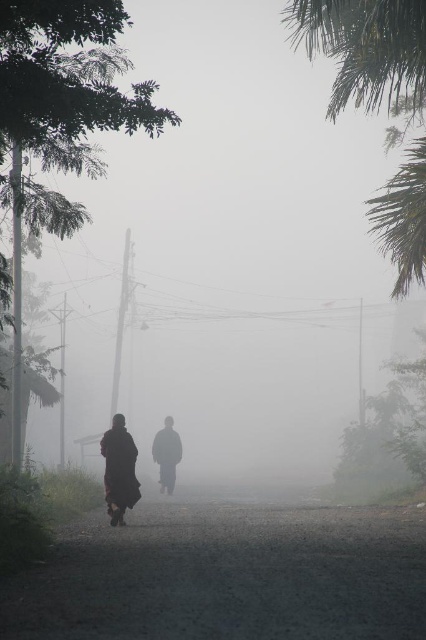
Is green leafy palm tree at upper right positioned before dark brown robe at center?

Yes, green leafy palm tree at upper right is closer to the viewer.

Is green leafy palm tree at upper right to the right of dark brown robe at center from the viewer's perspective?

Indeed, green leafy palm tree at upper right is positioned on the right side of dark brown robe at center.

You are a GUI agent. You are given a task and a screenshot of the screen. Output one action in this format:
    pyautogui.click(x=<x>, y=<y>)
    Task: Click on the green leafy palm tree at upper right
    This screenshot has width=426, height=640.
    Given the screenshot: What is the action you would take?
    pyautogui.click(x=367, y=52)

The image size is (426, 640). What do you see at coordinates (227, 576) in the screenshot?
I see `dark gravel road at center` at bounding box center [227, 576].

Is dark gravel road at center to the right of dark red robe at center from the viewer's perspective?

Yes, dark gravel road at center is to the right of dark red robe at center.

Identify the location of dark gravel road at center. (227, 576).

Is green leafy palm tree at upper right to the right of dark red robe at center from the viewer's perspective?

Indeed, green leafy palm tree at upper right is positioned on the right side of dark red robe at center.

Who is more distant from viewer, [422,68] or [100,449]?

Positioned behind is point [100,449].

Locate an element on the screen. The width and height of the screenshot is (426, 640). green leafy palm tree at upper right is located at coordinates (367, 52).